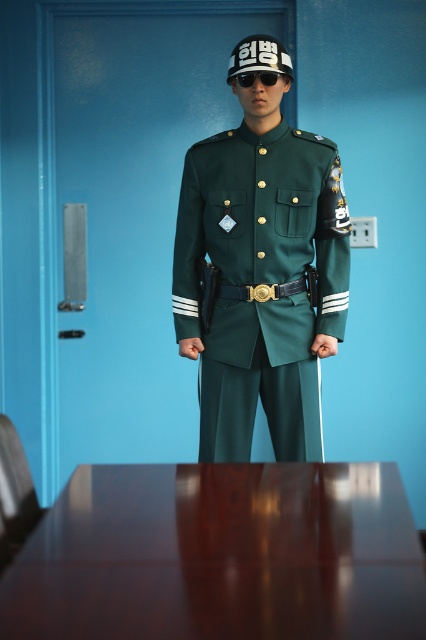
Who is more forward, (238,625) or (290,291)?

Point (238,625) is in front.

Which is in front, point (327, 579) or point (207, 296)?

Point (327, 579)

What are the coordinates of `glossy wood table at lower center` in the screenshot? It's located at (221, 556).

Who is positioned more to the right, green matte uniform at center or black plastic sunglasses at center?

green matte uniform at center

Is green matte uniform at center above black plastic sunglasses at center?

No.

Which is behind, point (322, 241) or point (261, 83)?

The point (322, 241) is more distant.

The image size is (426, 640). In order to click on green matte uniform at center in this screenshot , I will do `click(261, 282)`.

Is glossy wood table at lower center shorter than black plastic sunglasses at center?

No, glossy wood table at lower center is not shorter than black plastic sunglasses at center.

Looking at this image, can you confirm if glossy wood table at lower center is positioned to the right of black plastic sunglasses at center?

No, glossy wood table at lower center is not to the right of black plastic sunglasses at center.

Looking at this image, who is more distant from viewer, (42, 518) or (250, 76)?

The point (250, 76) is behind.

Where is `glossy wood table at lower center`? This screenshot has height=640, width=426. glossy wood table at lower center is located at coordinates (221, 556).